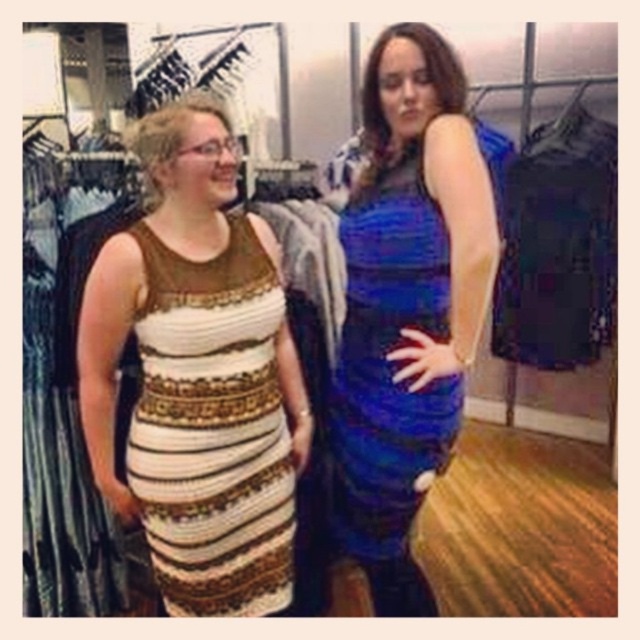
You are a customer in a clothing store and want to try on the shiny blue dress at center and the white textured dress at center. However, you can only reach one of them at a time. Based on their positions, which dress can you grab first without moving the other?

The shiny blue dress at center is in front of the white textured dress at center, so you can grab the shiny blue dress at center first without moving the other.